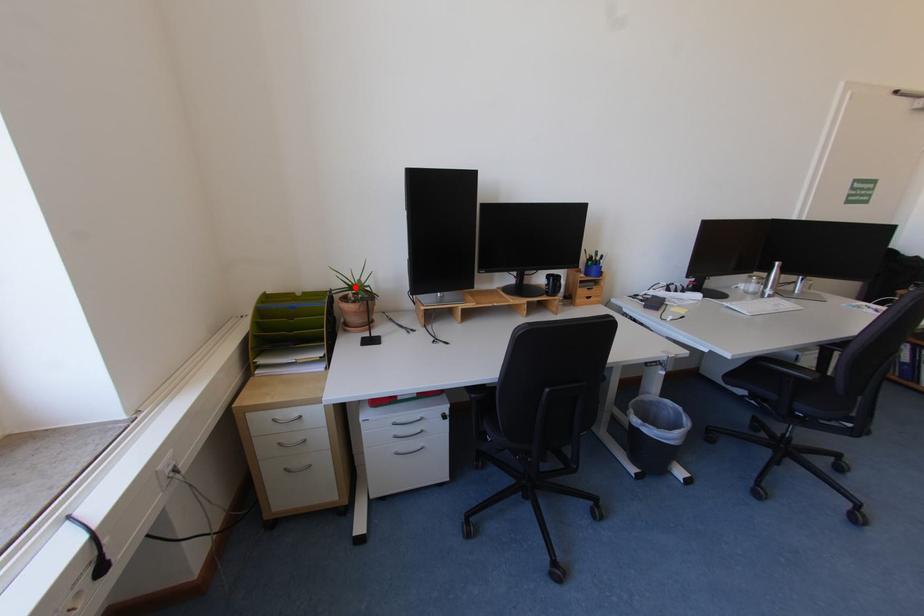
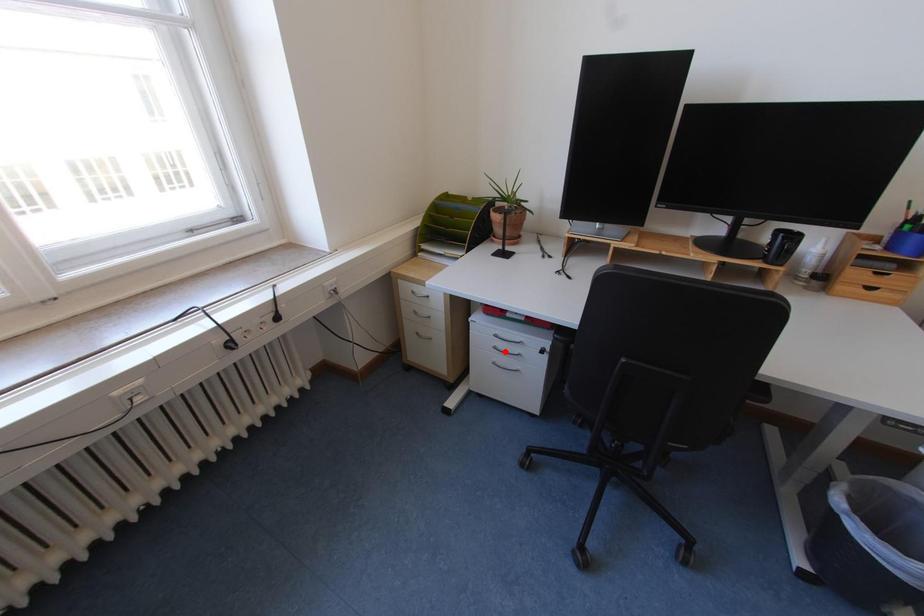
I am providing you with two images of the same scene from different viewpoints. A red point is marked on the first image and another point is marked on the second image. Is the marked point in image1 the same physical position as the marked point in image2?

No